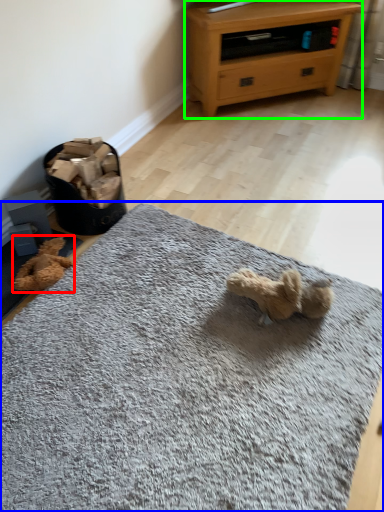
Question: Which is nearer to the teddy (highlighted by a red box)? mat (highlighted by a blue box) or chest of drawers (highlighted by a green box).

Choices:
 (A) mat
 (B) chest of drawers

Answer: (A)